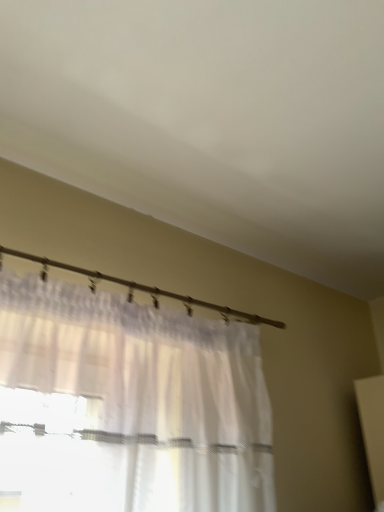
Describe the element at coordinates (141, 289) in the screenshot. This screenshot has width=384, height=512. I see `white sheer curtain at upper center` at that location.

At what (x,y) coordinates should I click in order to perform the action: click on white sheer curtain at upper center. Please return your answer as a coordinate pair (x, y). The height and width of the screenshot is (512, 384). Looking at the image, I should click on (141, 289).

What is the approximate height of white sheer curtain at upper center?

The height of white sheer curtain at upper center is 2.99 inches.

Image resolution: width=384 pixels, height=512 pixels. Identify the location of white sheer curtain at upper center. click(x=141, y=289).